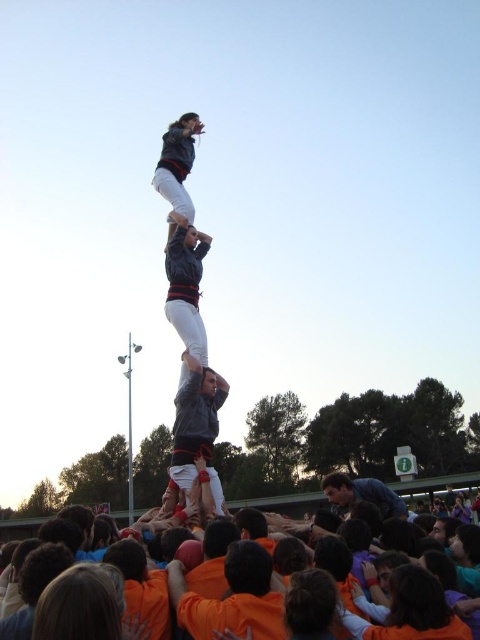
You are a photographer standing at the point labeled as point (441, 483) in the image. What is the closest object to you in the scene?

The closest object to you at point (441, 483) is the orange cotton crowd at lower center, as the point corresponds directly to their location.

You are a photographer standing at the base of the human tower. You want to take a photo that includes both the point at the bottom of the tower labeled as point (257, 618) and the higher point labeled as point (347, 508). Which point will appear larger in your photo?

Point (257, 618) will appear larger in the photo because it is closer to the camera than point (347, 508).

You are a photographer at the event and want to capture a photo of the orange cotton shirt at lower center and the blue denim shirt at center. Which shirt should you focus on first if you want to highlight the smaller one?

The orange cotton shirt at lower center has a smaller size compared to the blue denim shirt at center, so you should focus on the orange cotton shirt at lower center first to highlight the smaller one.